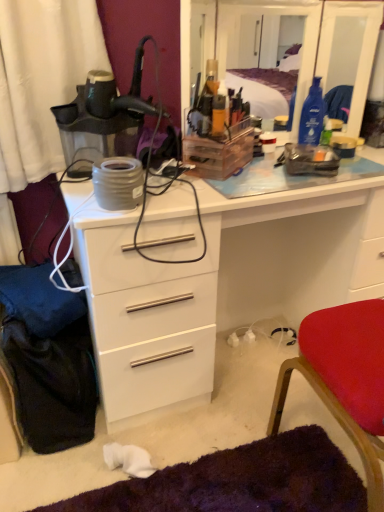
Question: In terms of width, does white glossy chest of drawers at center look wider or thinner when compared to red fabric chair at lower right?

Choices:
 (A) wide
 (B) thin

Answer: (A)

Question: Visually, is white glossy chest of drawers at center positioned to the left or to the right of red fabric chair at lower right?

Choices:
 (A) left
 (B) right

Answer: (A)

Question: Which is nearer to the transparent plastic mirror at upper center?

Choices:
 (A) red fabric chair at lower right
 (B) white glossy chest of drawers at center

Answer: (B)

Question: Which is nearer to the white glossy chest of drawers at center?

Choices:
 (A) transparent plastic mirror at upper center
 (B) red fabric chair at lower right

Answer: (B)